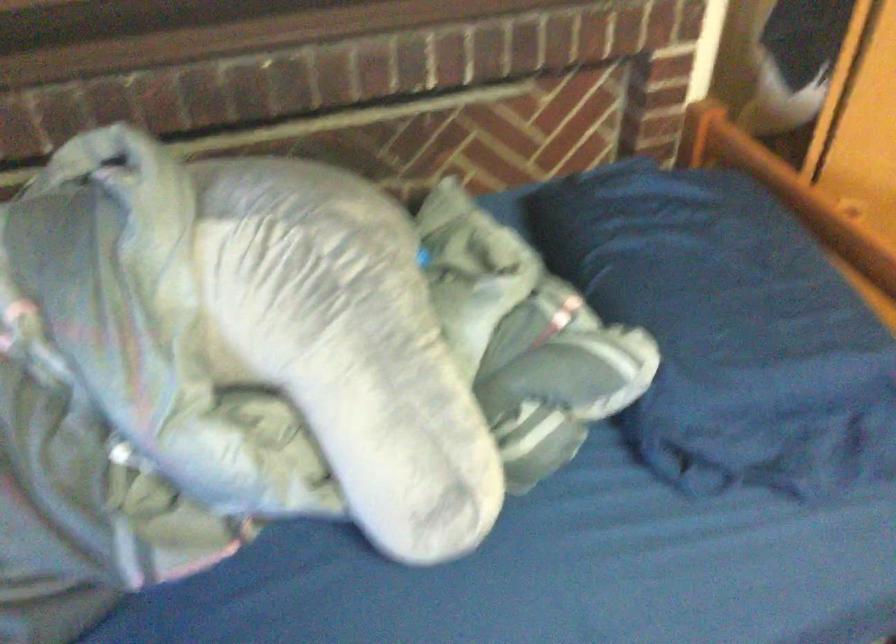
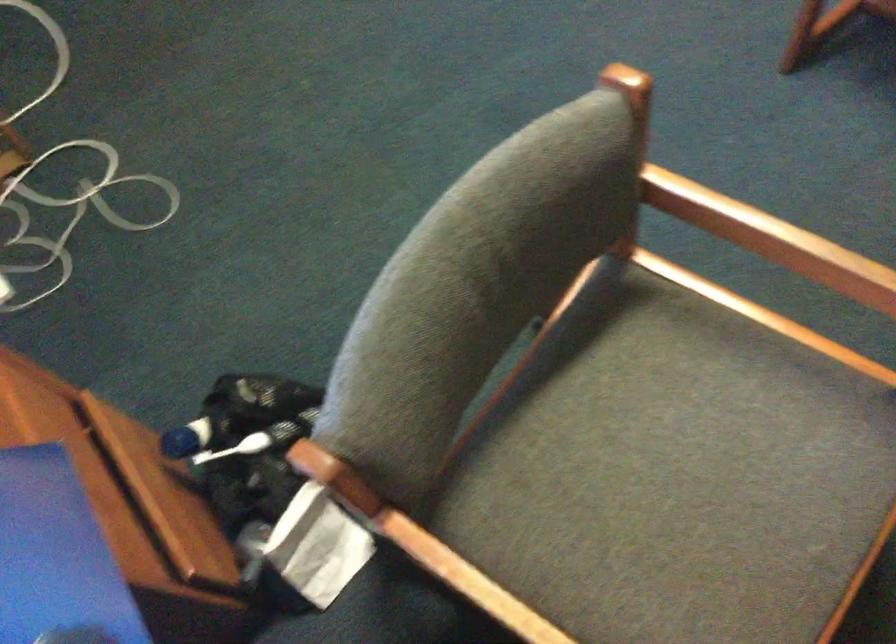
Based on the photo, the images are taken continuously from a first-person perspective. In which direction are you moving?

The cameraman moved toward right, backward.